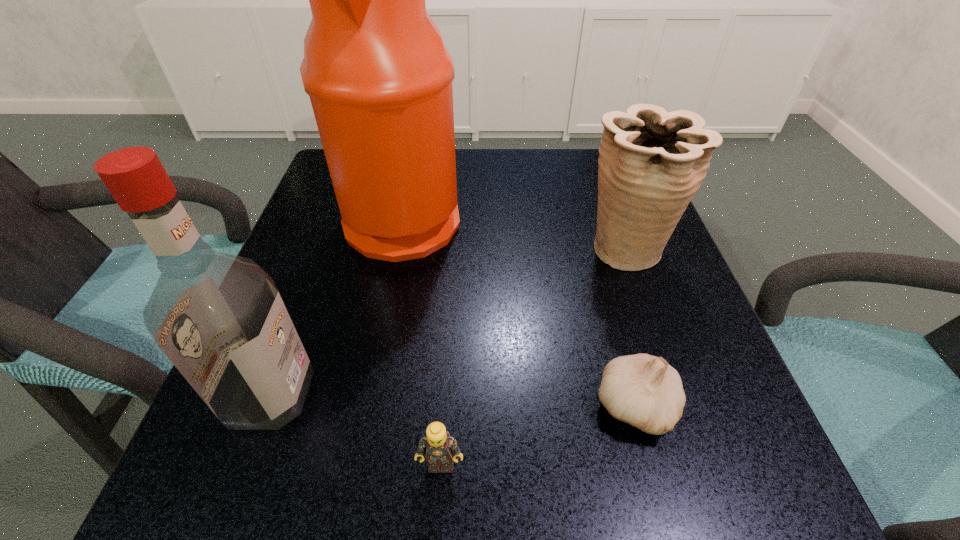
The image size is (960, 540). Identify the location of water jug. (379, 78).

The height and width of the screenshot is (540, 960). What are the coordinates of `liquor` in the screenshot? It's located at (219, 318).

Identify the location of the third shortest object. (651, 162).

You are a GUI agent. You are given a task and a screenshot of the screen. Output one action in this format:
    pyautogui.click(x=<x>, y=<y>)
    Task: Click on the garlic
    This screenshot has width=960, height=540.
    Given the screenshot: What is the action you would take?
    pyautogui.click(x=642, y=390)

Where is `Lego`? Lego is located at coordinates (441, 449).

Identify the location of free space located from the spout of the water jug. The height and width of the screenshot is (540, 960). [653, 218].

At what (x,y) coordinates should I click in order to perform the action: click on vacant region located on the front-facing side of the second tallest object. Please return your answer as a coordinate pair (x, y). Looking at the image, I should click on (571, 395).

The image size is (960, 540). I want to click on free space located 0.250m on the left of the third tallest object, so click(x=450, y=248).

Find the location of `free space located on the back of the garlic`. free space located on the back of the garlic is located at coordinates (614, 331).

You are a GUI agent. You are given a task and a screenshot of the screen. Output one action in this format:
    pyautogui.click(x=<x>, y=<y>)
    Task: Click on the object that is at the far edge
    This screenshot has height=540, width=960.
    Given the screenshot: What is the action you would take?
    pyautogui.click(x=379, y=78)